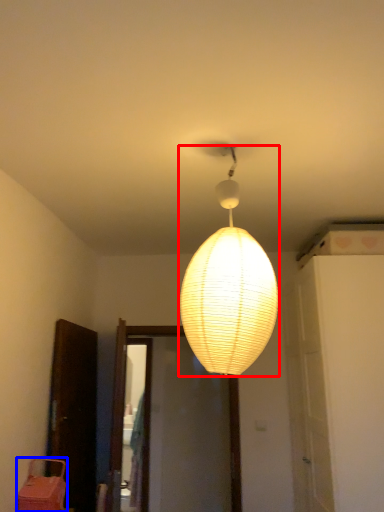
Question: Among these objects, which one is nearest to the camera, lamp (highlighted by a red box) or furniture (highlighted by a blue box)?

Choices:
 (A) lamp
 (B) furniture

Answer: (A)